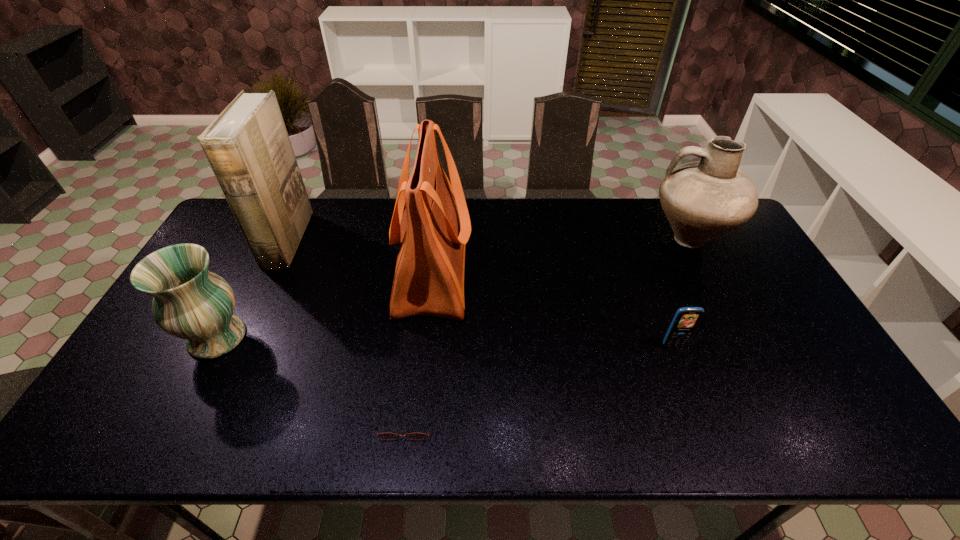
Where is `object that is at the left edge`? object that is at the left edge is located at coordinates (190, 302).

This screenshot has width=960, height=540. I want to click on object present at the right edge, so click(x=702, y=200).

The width and height of the screenshot is (960, 540). I want to click on object located at the far right corner, so click(702, 200).

Where is `vacant space at the far edge of the desktop`? The width and height of the screenshot is (960, 540). vacant space at the far edge of the desktop is located at coordinates coord(496,207).

In the image, there is a desktop. Where is `vacant space at the near edge`? The width and height of the screenshot is (960, 540). vacant space at the near edge is located at coordinates (619, 418).

Locate an element on the screen. free space at the left edge of the desktop is located at coordinates (197, 362).

Image resolution: width=960 pixels, height=540 pixels. I want to click on vacant area at the right edge, so click(x=727, y=284).

The image size is (960, 540). Identify the location of vacant space at the near left corner. (101, 422).

Identify the location of vacant space that's between the shortest object and the rightmost object. 547,330.

At what (x,y) coordinates should I click in order to perform the action: click on vacant space that is in between the cellular telephone and the shopping bag. Please return your answer as a coordinate pair (x, y). Image resolution: width=960 pixels, height=540 pixels. Looking at the image, I should click on (553, 308).